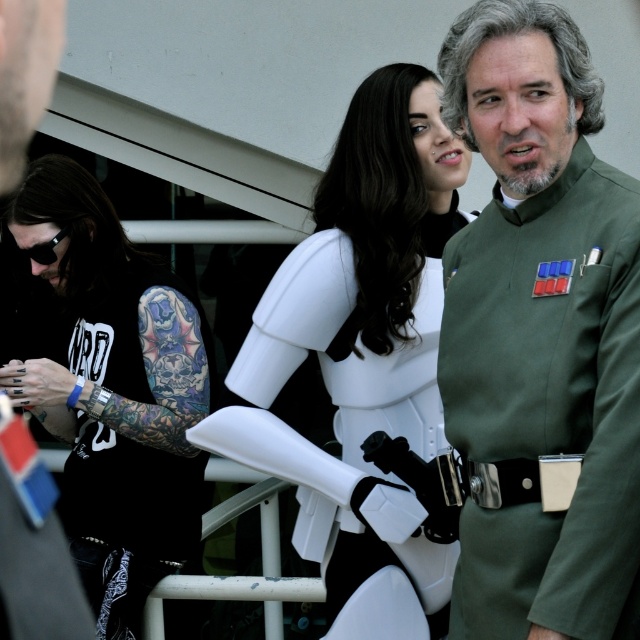
From the picture: You are standing at point (113, 390) in the image. What object is located at this point?

The white matte stormtrooper armor at center is located at point (113, 390).

From the picture: Based on the coordinates provided, which object is located at point (x=541, y=330) in the image?

The point (x=541, y=330) corresponds to the green matte uniform at center.